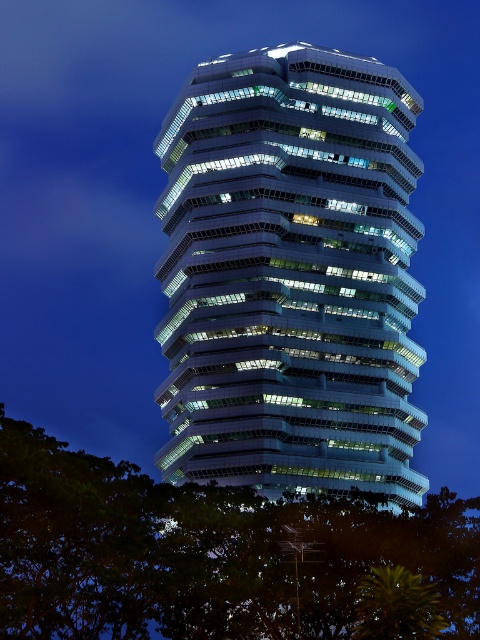
Question: Does white glass tower at center have a smaller size compared to green leafy tree at lower left?

Choices:
 (A) no
 (B) yes

Answer: (A)

Question: Which of the following is the farthest from the observer?

Choices:
 (A) green leafy tree at lower left
 (B) white glass tower at center

Answer: (B)

Question: Can you confirm if white glass tower at center is positioned below green leafy tree at lower left?

Choices:
 (A) no
 (B) yes

Answer: (A)

Question: Can you confirm if white glass tower at center is thinner than green leafy tree at lower left?

Choices:
 (A) yes
 (B) no

Answer: (A)

Question: Among these objects, which one is nearest to the camera?

Choices:
 (A) white glass tower at center
 (B) green leafy tree at lower left

Answer: (B)